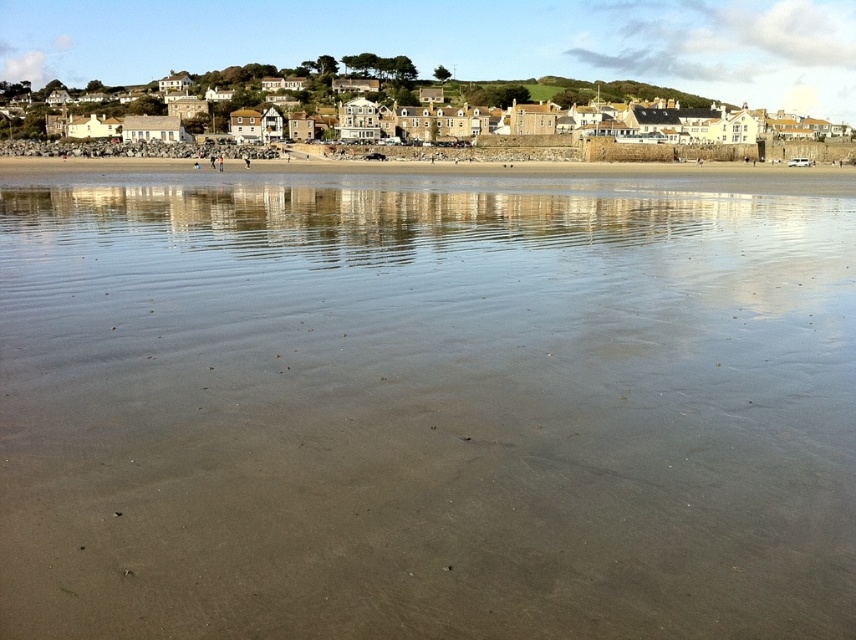
Question: Is smooth sand at lower center to the left of white stone houses at upper center from the viewer's perspective?

Choices:
 (A) yes
 (B) no

Answer: (B)

Question: Can you confirm if smooth sand at lower center is thinner than white stone houses at upper center?

Choices:
 (A) yes
 (B) no

Answer: (A)

Question: Which point is farther from the camera taking this photo?

Choices:
 (A) (611, 234)
 (B) (444, 141)

Answer: (B)

Question: Which point is closer to the camera?

Choices:
 (A) (432, 252)
 (B) (241, 131)

Answer: (A)

Question: Is smooth sand at lower center closer to the viewer compared to white stone houses at upper center?

Choices:
 (A) yes
 (B) no

Answer: (A)

Question: Which of the following is the farthest from the observer?

Choices:
 (A) smooth sand at lower center
 (B) white stone houses at upper center

Answer: (B)